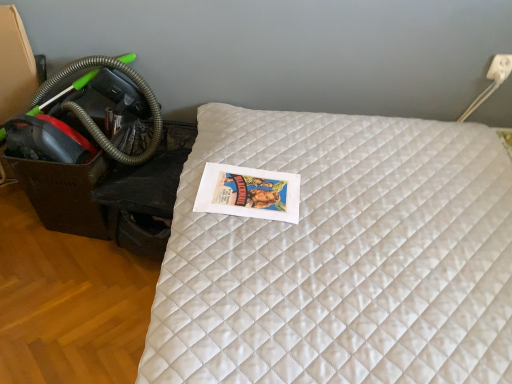
Question: Can you confirm if green rubber garden hose at left is wider than white plastic electric outlet at upper right?

Choices:
 (A) no
 (B) yes

Answer: (B)

Question: Is green rubber garden hose at left positioned in front of white plastic electric outlet at upper right?

Choices:
 (A) yes
 (B) no

Answer: (A)

Question: Is green rubber garden hose at left positioned with its back to white plastic electric outlet at upper right?

Choices:
 (A) no
 (B) yes

Answer: (A)

Question: From the image's perspective, is green rubber garden hose at left beneath white plastic electric outlet at upper right?

Choices:
 (A) yes
 (B) no

Answer: (A)

Question: From the image's perspective, is green rubber garden hose at left above white plastic electric outlet at upper right?

Choices:
 (A) no
 (B) yes

Answer: (A)

Question: Is green rubber garden hose at left positioned far away from white plastic electric outlet at upper right?

Choices:
 (A) yes
 (B) no

Answer: (A)

Question: Is white plastic electric outlet at upper right at the back of white quilted mattress at center?

Choices:
 (A) no
 (B) yes

Answer: (A)

Question: Is white quilted mattress at center far away from white plastic electric outlet at upper right?

Choices:
 (A) no
 (B) yes

Answer: (A)

Question: Is the position of white quilted mattress at center more distant than that of white plastic electric outlet at upper right?

Choices:
 (A) no
 (B) yes

Answer: (A)

Question: Is white quilted mattress at center aimed at white plastic electric outlet at upper right?

Choices:
 (A) yes
 (B) no

Answer: (B)

Question: From the image's perspective, would you say white quilted mattress at center is shown under white plastic electric outlet at upper right?

Choices:
 (A) yes
 (B) no

Answer: (A)

Question: Is white quilted mattress at center at the left side of white plastic electric outlet at upper right?

Choices:
 (A) yes
 (B) no

Answer: (A)

Question: Is white quilted mattress at center shorter than green rubber garden hose at left?

Choices:
 (A) no
 (B) yes

Answer: (A)